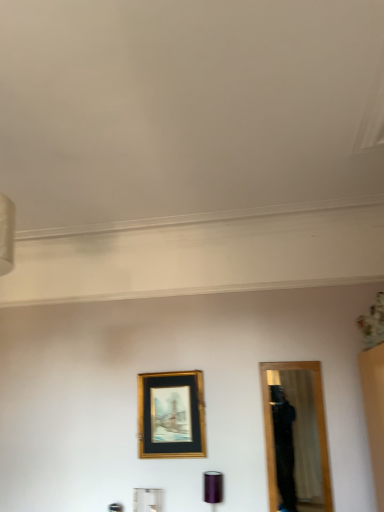
Question: Does purple metallic cylinder at lower center appear on the left side of gold metallic picture frame at center?

Choices:
 (A) no
 (B) yes

Answer: (A)

Question: Is the surface of purple metallic cylinder at lower center in direct contact with gold metallic picture frame at center?

Choices:
 (A) no
 (B) yes

Answer: (A)

Question: Is purple metallic cylinder at lower center outside of gold metallic picture frame at center?

Choices:
 (A) no
 (B) yes

Answer: (B)

Question: From the image's perspective, would you say purple metallic cylinder at lower center is shown under gold metallic picture frame at center?

Choices:
 (A) yes
 (B) no

Answer: (A)

Question: Is purple metallic cylinder at lower center thinner than gold metallic picture frame at center?

Choices:
 (A) no
 (B) yes

Answer: (A)

Question: Considering the relative sizes of purple metallic cylinder at lower center and gold metallic picture frame at center in the image provided, is purple metallic cylinder at lower center bigger than gold metallic picture frame at center?

Choices:
 (A) yes
 (B) no

Answer: (B)

Question: From the image's perspective, is gold metallic picture frame at center located above purple metallic cylinder at lower center?

Choices:
 (A) yes
 (B) no

Answer: (A)

Question: Does gold metallic picture frame at center have a greater width compared to purple metallic cylinder at lower center?

Choices:
 (A) no
 (B) yes

Answer: (A)

Question: Considering the relative sizes of gold metallic picture frame at center and purple metallic cylinder at lower center in the image provided, is gold metallic picture frame at center shorter than purple metallic cylinder at lower center?

Choices:
 (A) yes
 (B) no

Answer: (B)

Question: From a real-world perspective, is gold metallic picture frame at center below purple metallic cylinder at lower center?

Choices:
 (A) no
 (B) yes

Answer: (A)

Question: Considering the relative sizes of gold metallic picture frame at center and purple metallic cylinder at lower center in the image provided, is gold metallic picture frame at center smaller than purple metallic cylinder at lower center?

Choices:
 (A) yes
 (B) no

Answer: (B)

Question: Can you confirm if gold metallic picture frame at center is thinner than purple metallic cylinder at lower center?

Choices:
 (A) no
 (B) yes

Answer: (B)

Question: Is gold metallic picture frame at center bigger or smaller than purple metallic cylinder at lower center?

Choices:
 (A) big
 (B) small

Answer: (A)